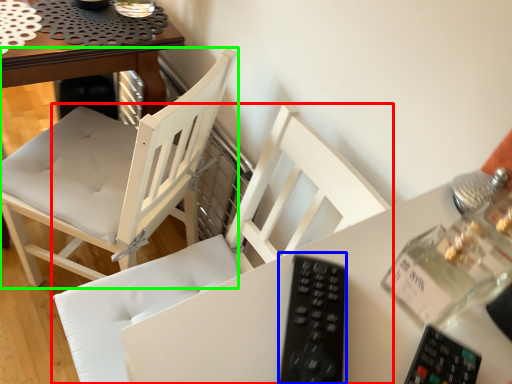
Question: Based on their relative distances, which object is nearer to chair (highlighted by a red box)? Choose from remote (highlighted by a blue box) and chair (highlighted by a green box).

Choices:
 (A) remote
 (B) chair

Answer: (B)